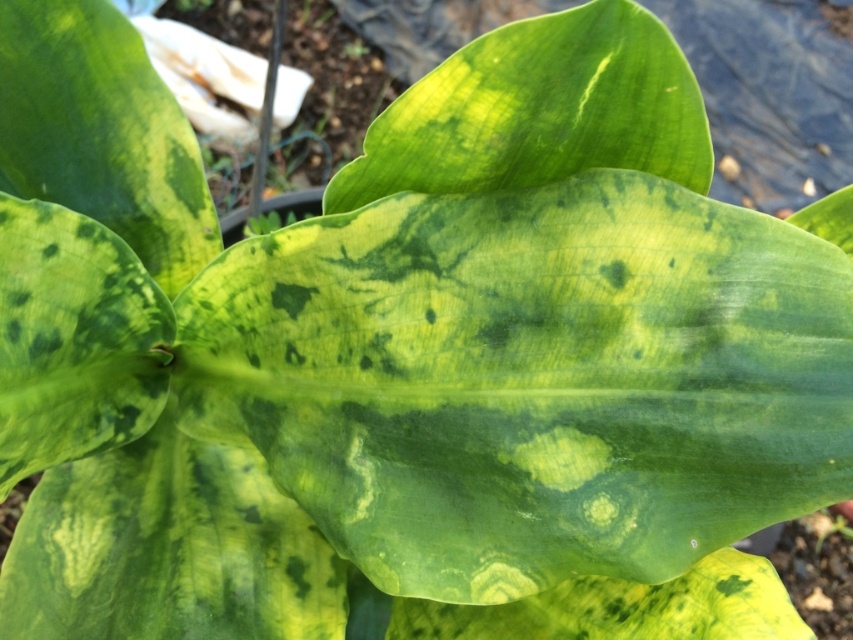
Can you confirm if green spotted leaf at center is positioned above green textured leaf at center?

No.

In the scene shown: Does green spotted leaf at center appear under green textured leaf at center?

Yes, green spotted leaf at center is below green textured leaf at center.

Does point (463, 529) come farther from viewer compared to point (424, 179)?

No, (463, 529) is closer to viewer.

At what (x,y) coordinates should I click in order to perform the action: click on green spotted leaf at center. Please return your answer as a coordinate pair (x, y). The width and height of the screenshot is (853, 640). Looking at the image, I should click on (529, 380).